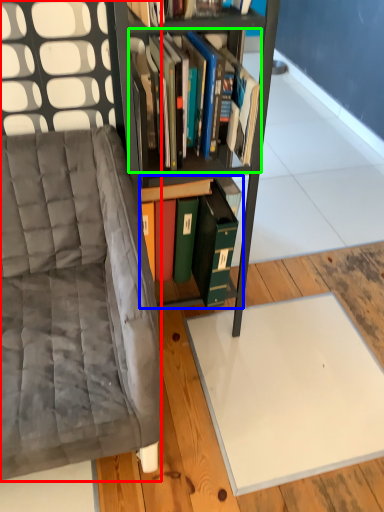
Question: Considering the real-world distances, which object is closest to chair (highlighted by a red box)? book (highlighted by a blue box) or book (highlighted by a green box).

Choices:
 (A) book
 (B) book

Answer: (A)